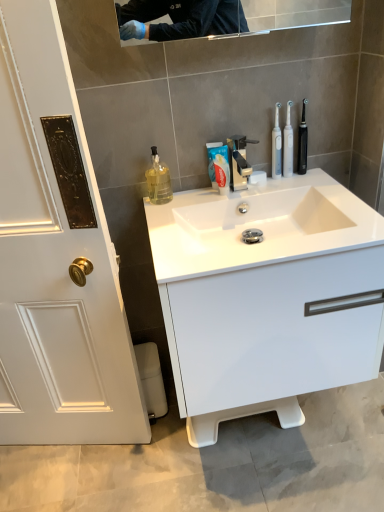
Locate an element on the screen. vacant point to the right of translucent glass mouthwash at left, the 1th mouthwash positioned from the left is located at coordinates click(193, 197).